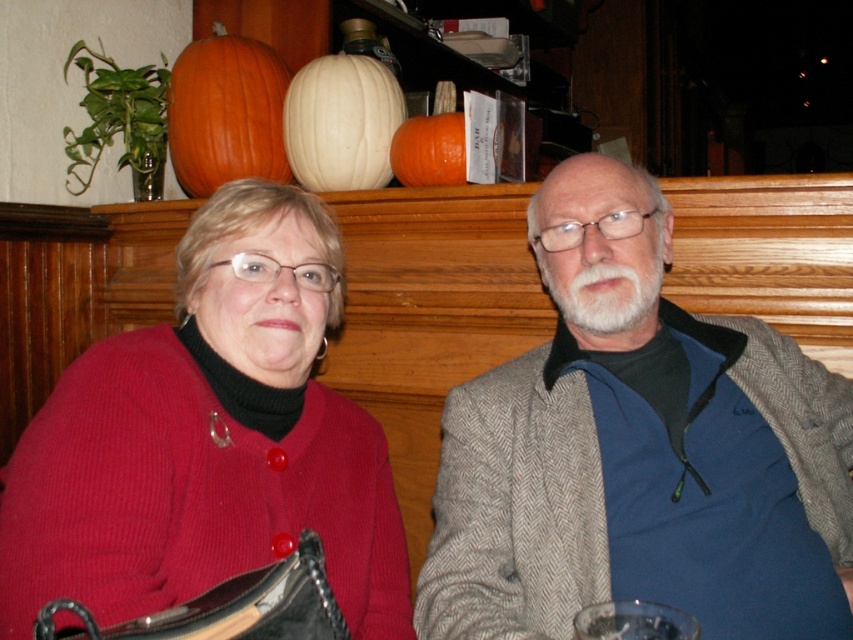
Question: From the image, what is the correct spatial relationship of blue woolen sweater at right in relation to white matte pumpkin at upper center?

Choices:
 (A) left
 (B) right

Answer: (B)

Question: Which is farther from the orange matte pumpkin at center?

Choices:
 (A) knitted red sweater at left
 (B) white matte pumpkin at upper center
 (C) blue woolen sweater at right

Answer: (A)

Question: Which object is farther from the camera taking this photo?

Choices:
 (A) orange matte pumpkin at upper left
 (B) orange matte pumpkin at center
 (C) blue woolen sweater at right
 (D) white matte pumpkin at upper center

Answer: (A)

Question: Among these objects, which one is farthest from the camera?

Choices:
 (A) white matte pumpkin at upper center
 (B) knitted red sweater at left
 (C) blue woolen sweater at right

Answer: (A)

Question: Does white matte pumpkin at upper center have a smaller size compared to orange matte pumpkin at center?

Choices:
 (A) no
 (B) yes

Answer: (A)

Question: Is orange matte pumpkin at upper left positioned at the back of orange matte pumpkin at center?

Choices:
 (A) no
 (B) yes

Answer: (B)